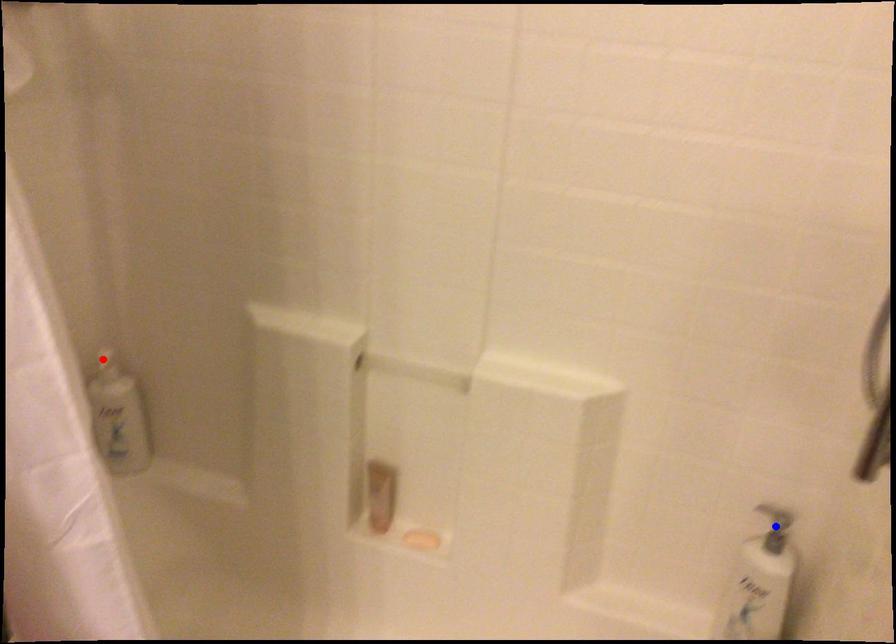
Question: Which of the two points in the image is closer to the camera?

Choices:
 (A) Blue point is closer.
 (B) Red point is closer.

Answer: (A)